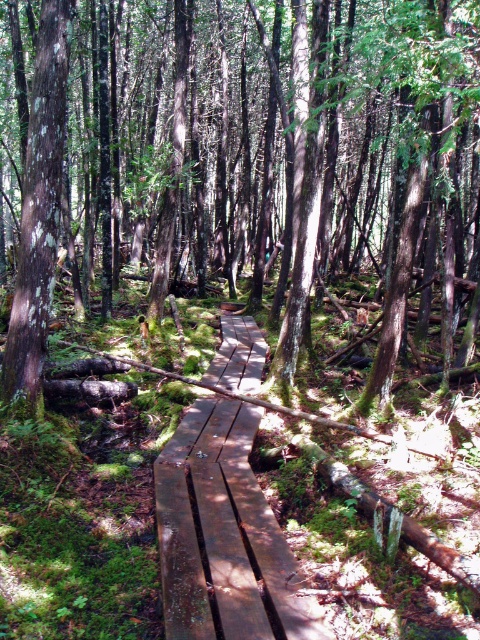
Question: Can you confirm if smooth brown wooden boardwalk at center is wider than smooth brown wooden bridge at center?

Choices:
 (A) no
 (B) yes

Answer: (B)

Question: Is smooth brown wooden boardwalk at center thinner than smooth brown wooden bridge at center?

Choices:
 (A) yes
 (B) no

Answer: (B)

Question: From the image, what is the correct spatial relationship of smooth brown wooden boardwalk at center in relation to smooth brown wooden bridge at center?

Choices:
 (A) above
 (B) below

Answer: (A)

Question: Which point is closer to the camera?

Choices:
 (A) (231, 132)
 (B) (248, 524)

Answer: (B)